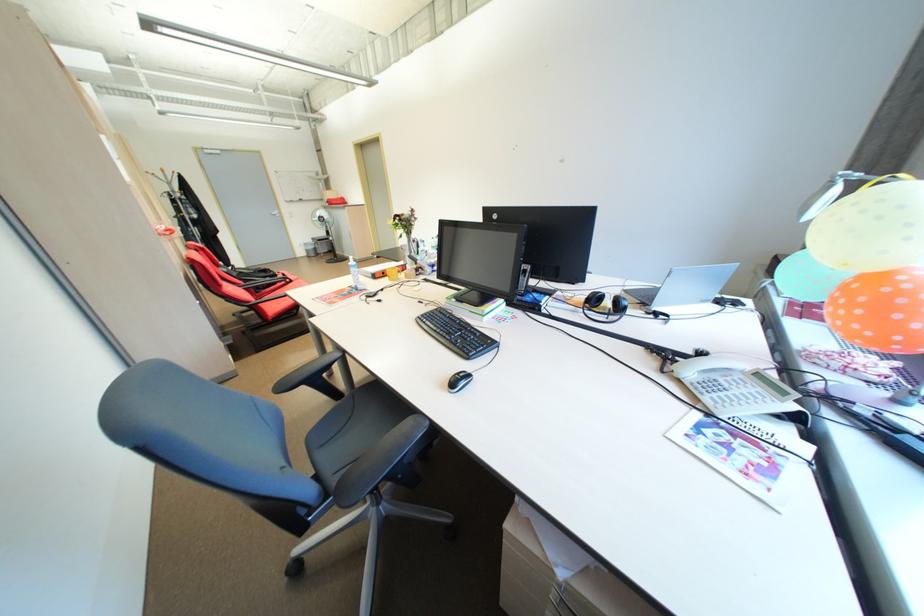
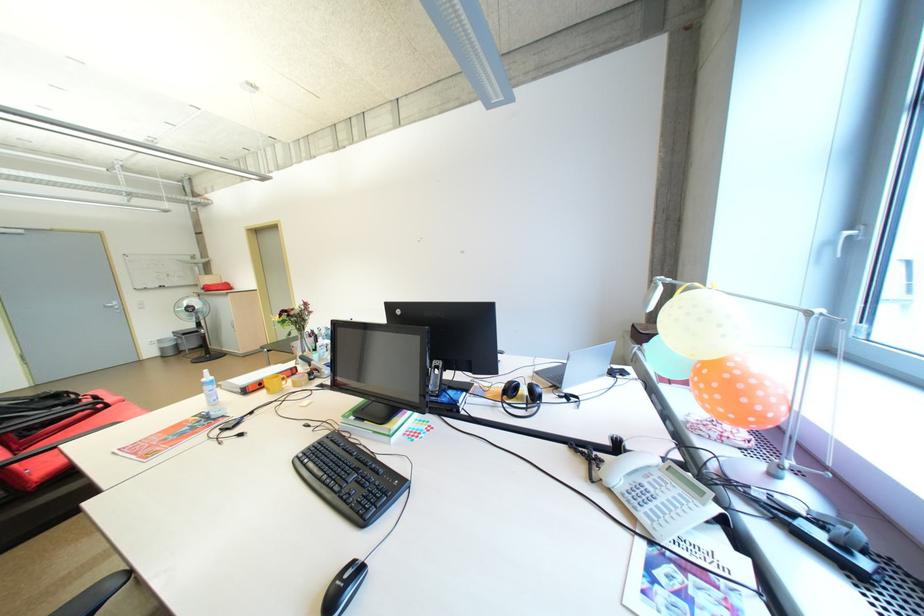
Which direction would the cameraman need to move to produce the second image?

The cameraman walked toward right, forward.